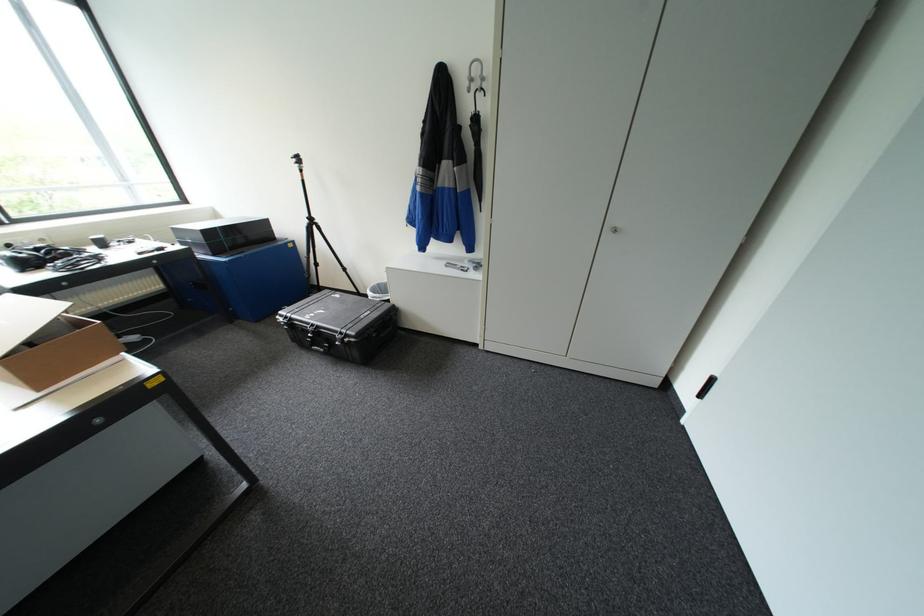
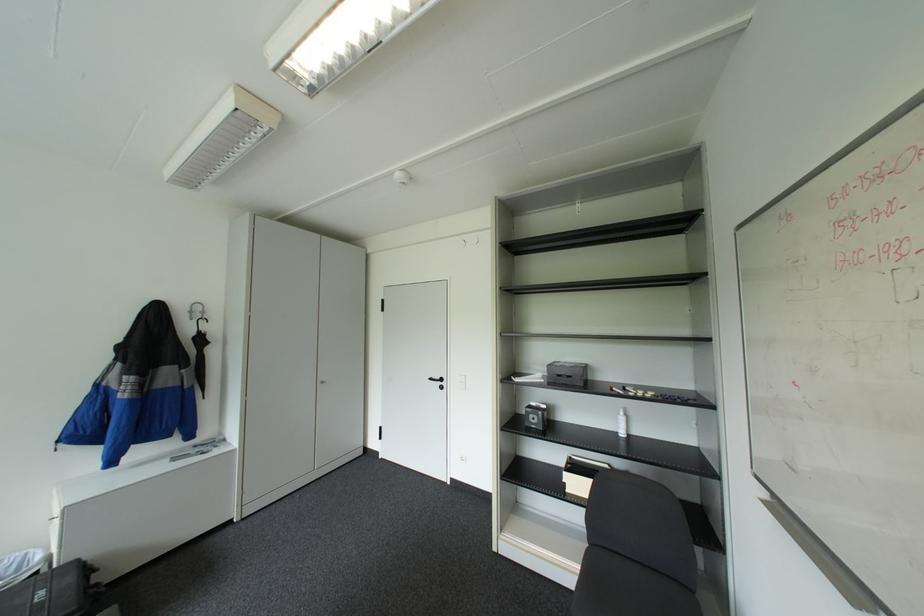
Where in the second image is the point corresponding to the point at 477,90 from the first image?

(200, 318)